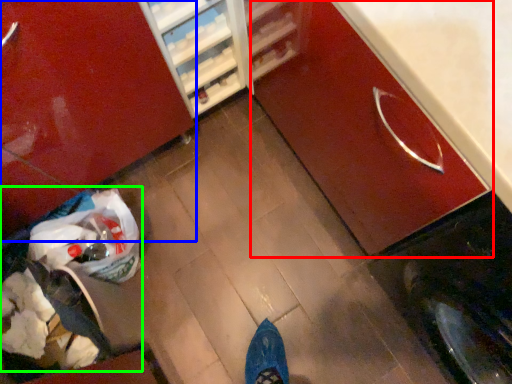
Question: Which object is positioned farthest from cabinetry (highlighted by a red box)? Select from cabinetry (highlighted by a blue box) and garbage (highlighted by a green box).

Choices:
 (A) cabinetry
 (B) garbage

Answer: (B)